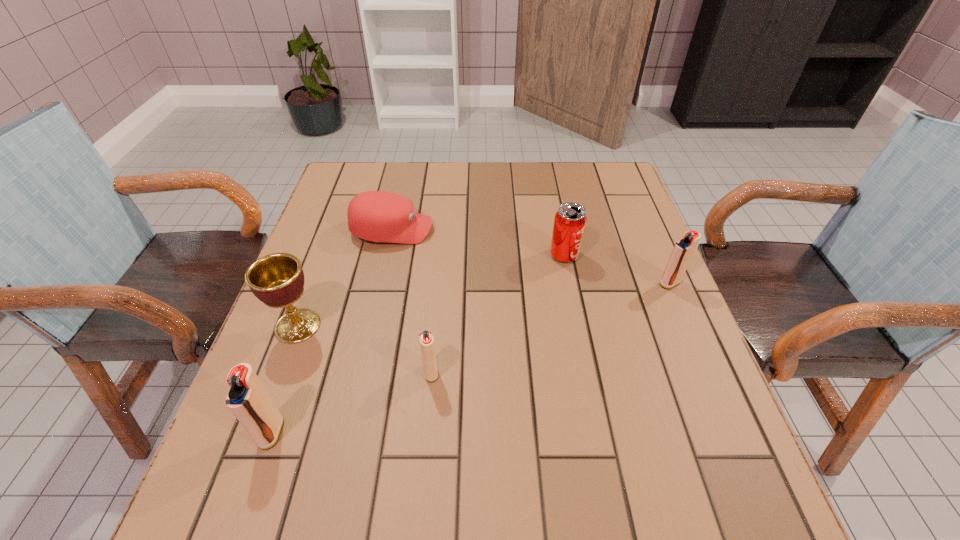
The width and height of the screenshot is (960, 540). What are the coordinates of `free space between the nearest igniter and the soda can` in the screenshot? It's located at (418, 344).

Locate an element on the screen. The image size is (960, 540). vacant space in between the fourth nearest object and the fifth object from left to right is located at coordinates (617, 269).

Find the location of a particular element. This screenshot has width=960, height=540. vacant area between the shortest object and the second object from right to left is located at coordinates (478, 242).

Locate an element on the screen. This screenshot has width=960, height=540. vacant space in between the third nearest object and the shortest object is located at coordinates (345, 278).

Where is `unoccupied area between the fourth farthest object and the shortest object`? The image size is (960, 540). unoccupied area between the fourth farthest object and the shortest object is located at coordinates (345, 278).

Locate an element on the screen. This screenshot has width=960, height=540. unoccupied position between the second shortest igniter and the fifth tallest object is located at coordinates point(550,328).

Locate an element on the screen. empty space that is in between the rightmost object and the nearest object is located at coordinates (470, 357).

Identify which object is the second closest to the fifth object from left to right. Please provide its 2D coordinates. Your answer should be formatted as a tuple, i.e. [(x, y)], where the tuple contains the x and y coordinates of a point satisfying the conditions above.

[(377, 216)]

Identify which object is the fourth closest to the nearest igniter. Please provide its 2D coordinates. Your answer should be formatted as a tuple, i.e. [(x, y)], where the tuple contains the x and y coordinates of a point satisfying the conditions above.

[(570, 220)]

Choose which igniter is the nearest neighbor to the second shortest object. Please provide its 2D coordinates. Your answer should be formatted as a tuple, i.e. [(x, y)], where the tuple contains the x and y coordinates of a point satisfying the conditions above.

[(248, 400)]